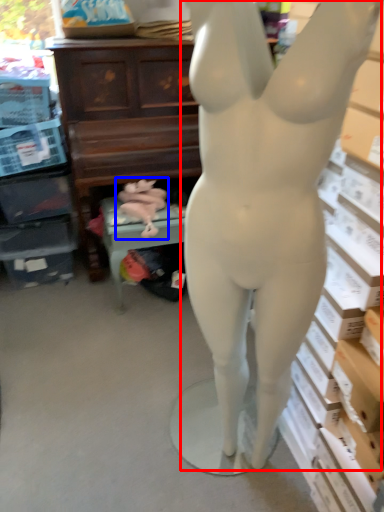
Question: Which of the following is the closest to the observer, person (highlighted by a red box) or animal sculpture (highlighted by a blue box)?

Choices:
 (A) person
 (B) animal sculpture

Answer: (A)